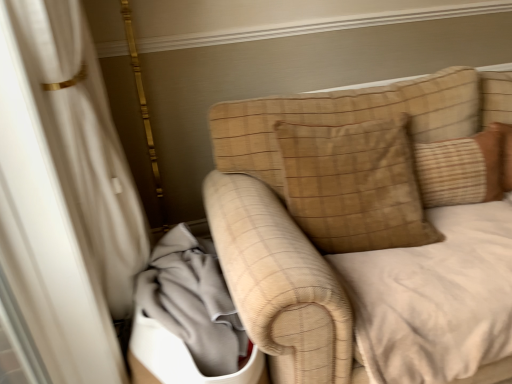
Question: Does brown textured pillow at upper right, which appears as the second pillow when viewed from the left, contain gray fabric at lower left?

Choices:
 (A) no
 (B) yes

Answer: (A)

Question: Does brown textured pillow at upper right, which appears as the second pillow when viewed from the left, turn towards gray fabric at lower left?

Choices:
 (A) yes
 (B) no

Answer: (B)

Question: Does brown textured pillow at upper right, acting as the 1th pillow starting from the right, appear on the right side of gray fabric at lower left?

Choices:
 (A) yes
 (B) no

Answer: (A)

Question: From the image's perspective, is brown textured pillow at upper right, acting as the 1th pillow starting from the right, over gray fabric at lower left?

Choices:
 (A) yes
 (B) no

Answer: (A)

Question: From a real-world perspective, is brown textured pillow at upper right, acting as the 1th pillow starting from the right, positioned under gray fabric at lower left based on gravity?

Choices:
 (A) no
 (B) yes

Answer: (A)

Question: Is brown suede pillow at upper right, the second pillow viewed from the right, in front of or behind gray fabric at lower left in the image?

Choices:
 (A) behind
 (B) front

Answer: (A)

Question: Looking at their shapes, would you say brown suede pillow at upper right, the first pillow from the left, is wider or thinner than gray fabric at lower left?

Choices:
 (A) wide
 (B) thin

Answer: (B)

Question: Is point (246, 122) closer or farther from the camera than point (175, 317)?

Choices:
 (A) farther
 (B) closer

Answer: (A)

Question: In terms of size, does brown suede pillow at upper right, the first pillow from the left, appear bigger or smaller than gray fabric at lower left?

Choices:
 (A) big
 (B) small

Answer: (A)

Question: Considering the positions of brown textured pillow at upper right, which appears as the second pillow when viewed from the left, and brown suede pillow at upper right, the second pillow viewed from the right, in the image, is brown textured pillow at upper right, which appears as the second pillow when viewed from the left, wider or thinner than brown suede pillow at upper right, the second pillow viewed from the right,?

Choices:
 (A) wide
 (B) thin

Answer: (B)

Question: Which is correct: brown textured pillow at upper right, acting as the 1th pillow starting from the right, is inside brown suede pillow at upper right, the second pillow viewed from the right, or outside of it?

Choices:
 (A) outside
 (B) inside

Answer: (A)

Question: Based on their positions, is brown textured pillow at upper right, which appears as the second pillow when viewed from the left, located to the left or right of brown suede pillow at upper right, the first pillow from the left?

Choices:
 (A) right
 (B) left

Answer: (A)

Question: From a real-world perspective, relative to brown suede pillow at upper right, the second pillow viewed from the right, is brown textured pillow at upper right, acting as the 1th pillow starting from the right, vertically above or below?

Choices:
 (A) above
 (B) below

Answer: (B)

Question: From the image's perspective, relative to brown textured pillow at upper right, acting as the 1th pillow starting from the right, is gray fabric at lower left above or below?

Choices:
 (A) below
 (B) above

Answer: (A)

Question: Based on their positions, is gray fabric at lower left located to the left or right of brown textured pillow at upper right, acting as the 1th pillow starting from the right?

Choices:
 (A) right
 (B) left

Answer: (B)